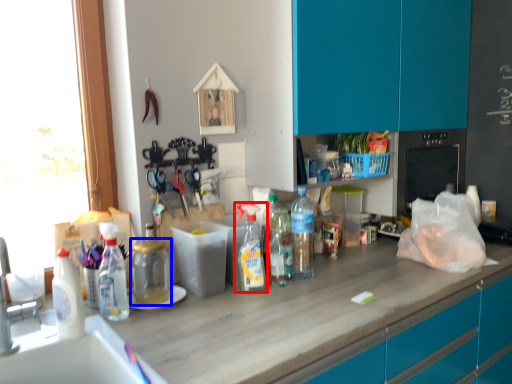
Question: Which point is closer to the camera, bottle (highlighted by a red box) or bottle (highlighted by a blue box)?

Choices:
 (A) bottle
 (B) bottle

Answer: (B)